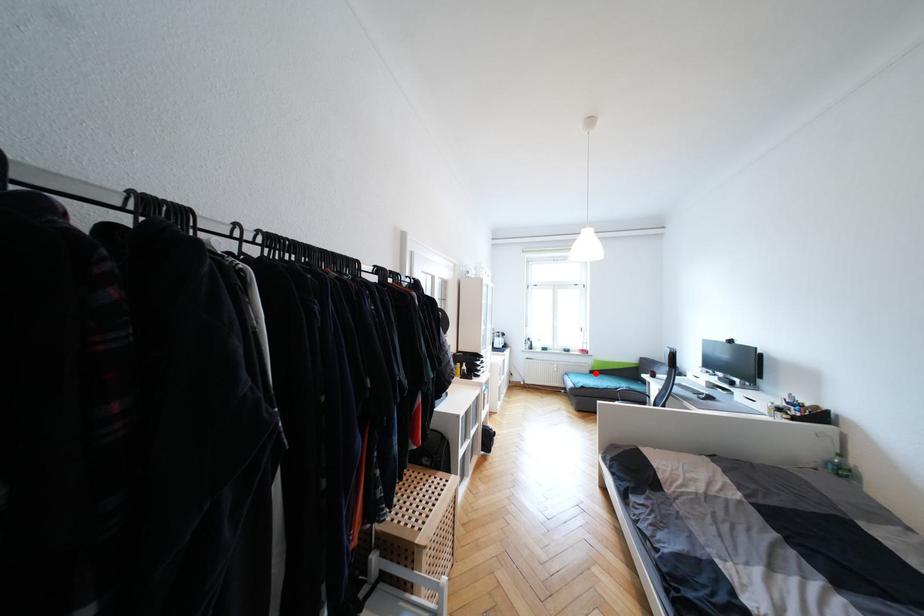
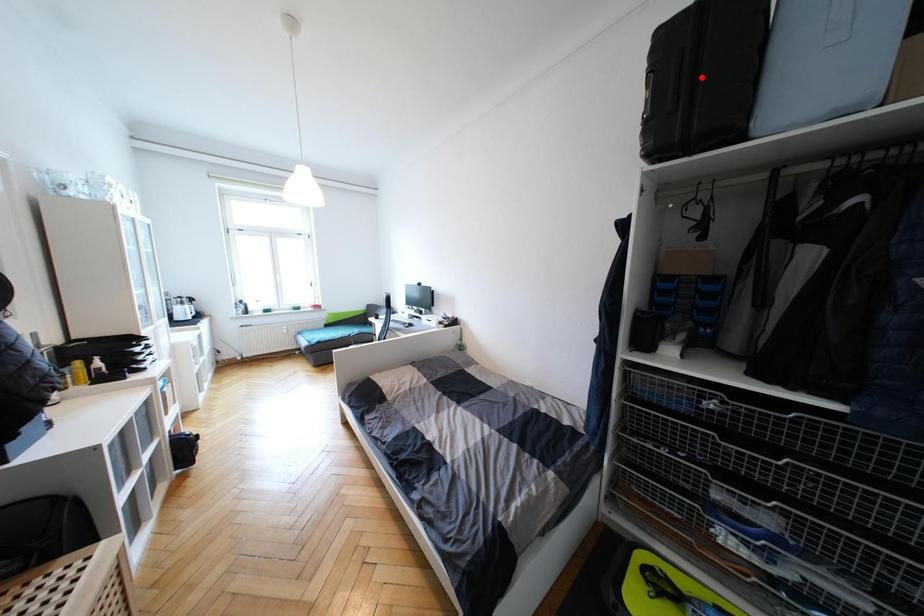
I am providing you with two images of the same scene from different viewpoints. A red point is marked on the first image and another point is marked on the second image. Is the red point in image1 aligned with the point shown in image2?

No